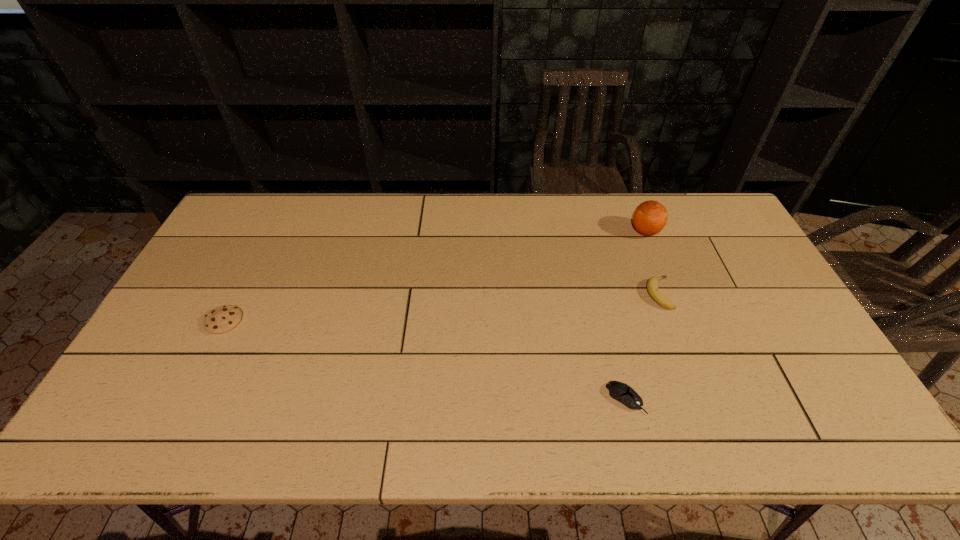
At what (x,y) coordinates should I click in order to perform the action: click on the farthest object. Please return your answer as a coordinate pair (x, y). The image size is (960, 540). Looking at the image, I should click on tap(650, 217).

The image size is (960, 540). Identify the location of orange. [x=650, y=217].

You are a GUI agent. You are given a task and a screenshot of the screen. Output one action in this format:
    pyautogui.click(x=<x>, y=<y>)
    Task: Click on the leftmost object
    This screenshot has width=960, height=540.
    Given the screenshot: What is the action you would take?
    pyautogui.click(x=224, y=318)

Find the location of a particular element. The width and height of the screenshot is (960, 540). banana is located at coordinates (x=652, y=285).

Find the location of a particular element. the second object from left to right is located at coordinates (619, 391).

Find the location of `computer mouse`. computer mouse is located at coordinates (619, 391).

You are a GUI agent. You are given a task and a screenshot of the screen. Output one action in this format:
    pyautogui.click(x=<x>, y=<y>)
    Task: Click on the free space located on the front of the tallest object
    
    Given the screenshot: What is the action you would take?
    pyautogui.click(x=661, y=271)

I want to click on free space located 0.090m on the left of the cookie, so click(x=174, y=321).

The image size is (960, 540). I want to click on free space located 0.170m on the back of the banana, so click(639, 240).

Identify the location of vacant space located on the left of the computer mouse. (445, 399).